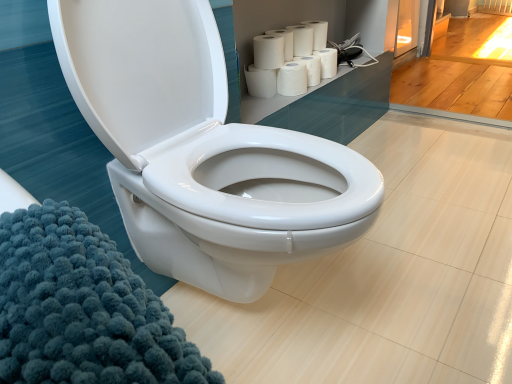
Question: Is white matte paper towel at upper right, which is the third paper towel from bottom to top, positioned behind white matte toilet paper at upper right, arranged as the 1th toilet paper when ordered from the bottom?

Choices:
 (A) yes
 (B) no

Answer: (B)

Question: Does white matte paper towel at upper right, the fourth paper towel positioned from the top, appear on the left side of white matte toilet paper at upper right, arranged as the 1th toilet paper when ordered from the bottom?

Choices:
 (A) yes
 (B) no

Answer: (A)

Question: From the image's perspective, is white matte paper towel at upper right, the fourth paper towel positioned from the top, on white matte toilet paper at upper right, arranged as the 1th toilet paper when ordered from the bottom?

Choices:
 (A) no
 (B) yes

Answer: (A)

Question: Would you say white matte paper towel at upper right, the fourth paper towel positioned from the top, contains white matte toilet paper at upper right, arranged as the 1th toilet paper when ordered from the bottom?

Choices:
 (A) yes
 (B) no

Answer: (B)

Question: Can you confirm if white matte paper towel at upper right, which is the third paper towel from bottom to top, is bigger than white matte toilet paper at upper right, arranged as the 1th toilet paper when ordered from the bottom?

Choices:
 (A) no
 (B) yes

Answer: (A)

Question: From a real-world perspective, is white matte paper towel at upper center, which is the sixth paper towel from bottom to top, positioned above or below white matte paper towel at upper center, the 5th paper towel when ordered from bottom to top?

Choices:
 (A) below
 (B) above

Answer: (B)

Question: From the image's perspective, is white matte paper towel at upper center, which is the sixth paper towel from bottom to top, above or below white matte paper towel at upper center, the 2th paper towel when ordered from top to bottom?

Choices:
 (A) above
 (B) below

Answer: (A)

Question: Considering the positions of point (292, 34) and point (288, 46), is point (292, 34) closer or farther from the camera than point (288, 46)?

Choices:
 (A) farther
 (B) closer

Answer: (A)

Question: Is white matte paper towel at upper center, which is the sixth paper towel from bottom to top, taller or shorter than white matte paper towel at upper center, the 2th paper towel when ordered from top to bottom?

Choices:
 (A) short
 (B) tall

Answer: (B)

Question: Does point (320, 44) appear closer or farther from the camera than point (295, 26)?

Choices:
 (A) closer
 (B) farther

Answer: (B)

Question: Visually, is white matte toilet paper at upper center, which is the 2th toilet paper from bottom to top, positioned to the left or to the right of white matte paper towel at upper center, which is the sixth paper towel from bottom to top?

Choices:
 (A) left
 (B) right

Answer: (B)

Question: In terms of size, does white matte toilet paper at upper center, which is the first toilet paper from top to bottom, appear bigger or smaller than white matte paper towel at upper center, which is the sixth paper towel from bottom to top?

Choices:
 (A) big
 (B) small

Answer: (B)

Question: Which is correct: white matte toilet paper at upper center, which is the 2th toilet paper from bottom to top, is inside white matte paper towel at upper center, which is the sixth paper towel from bottom to top, or outside of it?

Choices:
 (A) outside
 (B) inside

Answer: (A)

Question: Is point (314, 26) closer or farther from the camera than point (280, 51)?

Choices:
 (A) closer
 (B) farther

Answer: (B)

Question: In terms of width, does white matte toilet paper at upper center, which is the first toilet paper from top to bottom, look wider or thinner when compared to white matte paper towels at upper right, the third paper towel when ordered from top to bottom?

Choices:
 (A) wide
 (B) thin

Answer: (B)